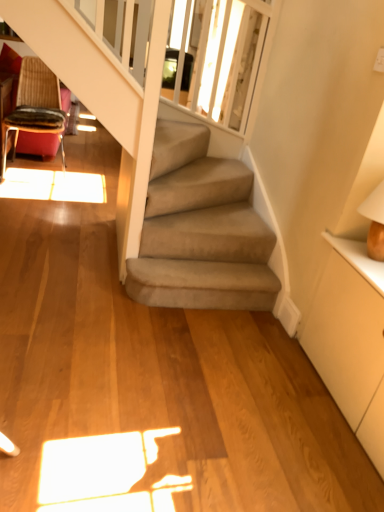
Question: Should I look upward or downward to see white matte dresser at right?

Choices:
 (A) up
 (B) down

Answer: (B)

Question: Considering the relative sizes of wooden textured chair at upper left and white matte dresser at right in the image provided, is wooden textured chair at upper left shorter than white matte dresser at right?

Choices:
 (A) no
 (B) yes

Answer: (A)

Question: Is wooden textured chair at upper left bigger than white matte dresser at right?

Choices:
 (A) no
 (B) yes

Answer: (B)

Question: Considering the relative sizes of wooden textured chair at upper left and white matte dresser at right in the image provided, is wooden textured chair at upper left thinner than white matte dresser at right?

Choices:
 (A) yes
 (B) no

Answer: (B)

Question: From the image's perspective, is wooden textured chair at upper left located above white matte dresser at right?

Choices:
 (A) yes
 (B) no

Answer: (A)

Question: Considering the relative positions of wooden textured chair at upper left and white matte dresser at right in the image provided, is wooden textured chair at upper left to the right of white matte dresser at right from the viewer's perspective?

Choices:
 (A) yes
 (B) no

Answer: (B)

Question: From a real-world perspective, is wooden textured chair at upper left beneath white matte dresser at right?

Choices:
 (A) no
 (B) yes

Answer: (A)

Question: Does translucent glass window screen at upper center have a greater width compared to wooden textured chair at upper left?

Choices:
 (A) yes
 (B) no

Answer: (B)

Question: Can you confirm if translucent glass window screen at upper center is thinner than wooden textured chair at upper left?

Choices:
 (A) no
 (B) yes

Answer: (B)

Question: From a real-world perspective, does translucent glass window screen at upper center sit lower than wooden textured chair at upper left?

Choices:
 (A) no
 (B) yes

Answer: (A)

Question: Is translucent glass window screen at upper center outside of wooden textured chair at upper left?

Choices:
 (A) no
 (B) yes

Answer: (B)

Question: From the image's perspective, is translucent glass window screen at upper center located above wooden textured chair at upper left?

Choices:
 (A) yes
 (B) no

Answer: (A)

Question: Could you tell me if translucent glass window screen at upper center is facing wooden textured chair at upper left?

Choices:
 (A) no
 (B) yes

Answer: (A)

Question: Are wooden textured chair at upper left and translucent glass window screen at upper center beside each other?

Choices:
 (A) yes
 (B) no

Answer: (B)